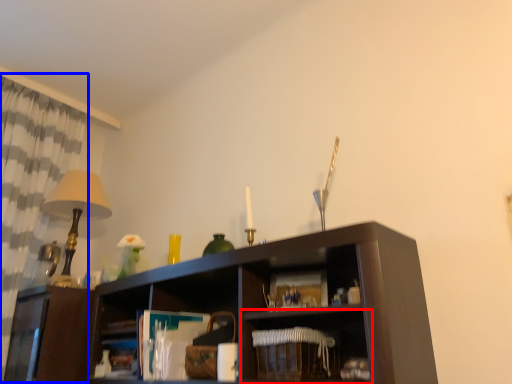
Question: Which object appears closest to the camera in this image, shelf (highlighted by a red box) or curtain (highlighted by a blue box)?

Choices:
 (A) shelf
 (B) curtain

Answer: (A)